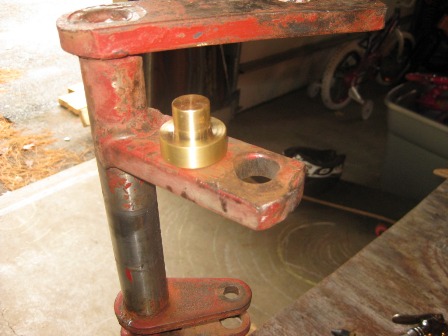
In order to click on white wall in this screenshot , I will do `click(261, 85)`, `click(258, 47)`.